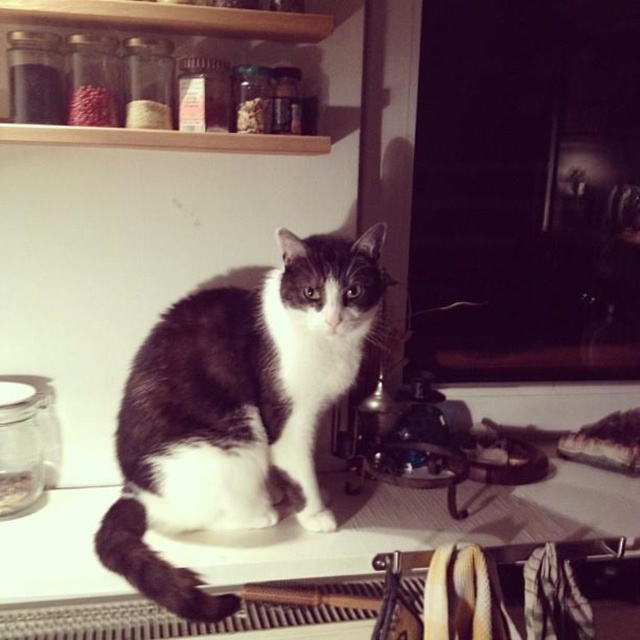
You are a photographer standing in front of the kitchen counter where the cat is sitting. You want to take a photo that includes both the point at coordinates point (561, 499) and point (163, 20). Which point should you focus on first to ensure both are in focus?

You should focus on point (163, 20) first because it is closer to you than point (561, 499), which is further away. By focusing on the closer point, the further point will also be in focus due to depth of field.

You are a chef preparing a recipe and need to move a bowl from the wooden shelf at upper center to the white glossy counter top at center. In which direction should you move the bowl to place it on the correct surface?

The white glossy counter top at center is to the right of the wooden shelf at upper center, so you should move the bowl to the right to place it on the white glossy counter top at center.